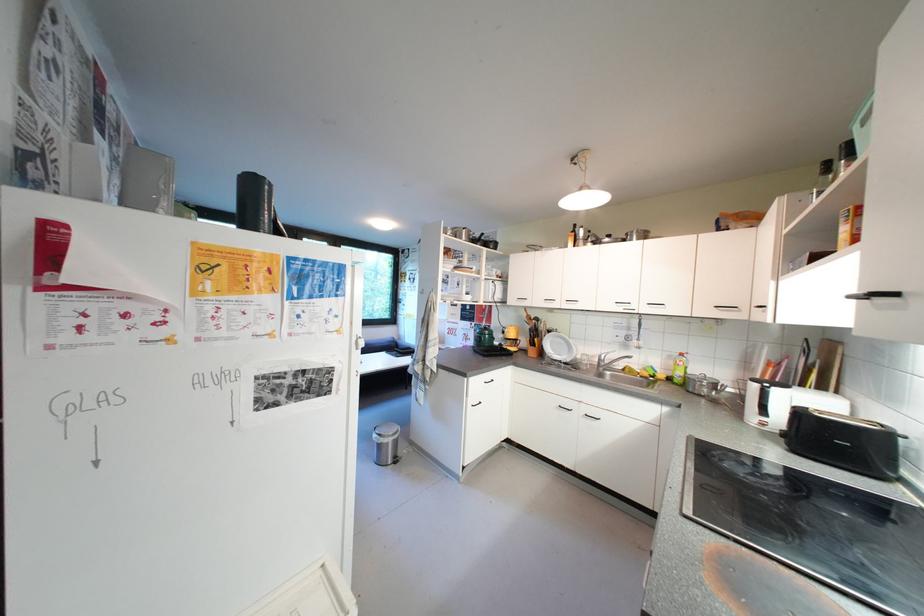
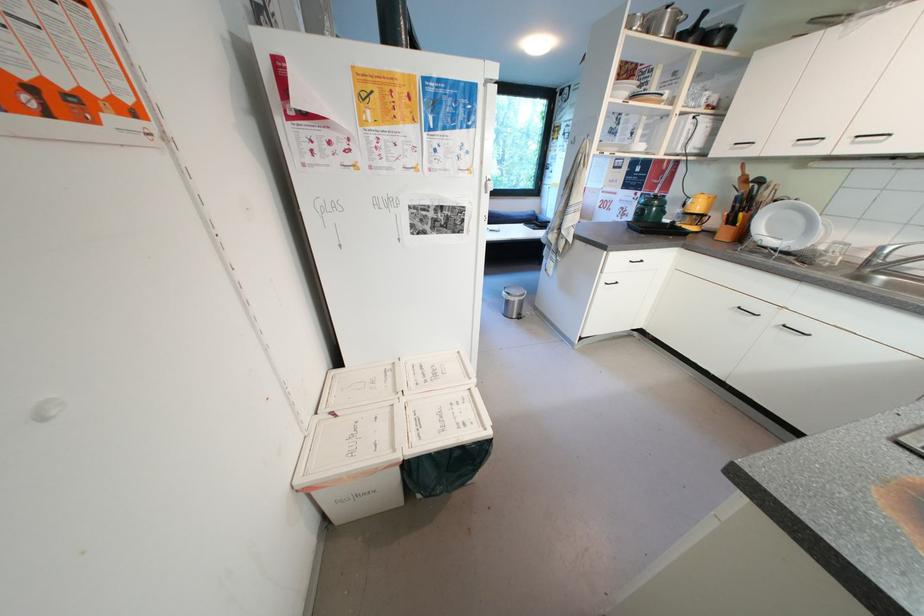
Find the pixel in the second image that matches point (608, 362) in the first image.

(883, 257)